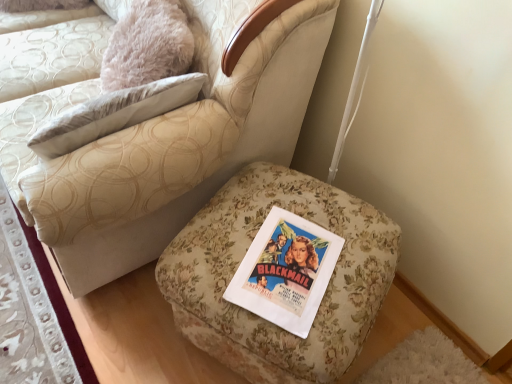
Question: From the image's perspective, is floral fabric ottoman at lower left located above floral fabric ottoman at lower right?

Choices:
 (A) yes
 (B) no

Answer: (B)

Question: Would you say floral fabric ottoman at lower left contains floral fabric ottoman at lower right?

Choices:
 (A) no
 (B) yes

Answer: (A)

Question: Does floral fabric ottoman at lower left have a greater width compared to floral fabric ottoman at lower right?

Choices:
 (A) no
 (B) yes

Answer: (A)

Question: Considering the relative sizes of floral fabric ottoman at lower left and floral fabric ottoman at lower right in the image provided, is floral fabric ottoman at lower left shorter than floral fabric ottoman at lower right?

Choices:
 (A) no
 (B) yes

Answer: (B)

Question: From the image's perspective, is floral fabric ottoman at lower left beneath floral fabric ottoman at lower right?

Choices:
 (A) no
 (B) yes

Answer: (B)

Question: In the image, is floral fabric ottoman at lower right positioned in front of or behind floral fabric ottoman at center?

Choices:
 (A) front
 (B) behind

Answer: (B)

Question: In terms of size, does floral fabric ottoman at lower right appear bigger or smaller than floral fabric ottoman at center?

Choices:
 (A) small
 (B) big

Answer: (A)

Question: Considering the positions of floral fabric ottoman at lower right and floral fabric ottoman at center in the image, is floral fabric ottoman at lower right taller or shorter than floral fabric ottoman at center?

Choices:
 (A) short
 (B) tall

Answer: (A)

Question: From the image's perspective, is floral fabric ottoman at lower right located above or below floral fabric ottoman at center?

Choices:
 (A) above
 (B) below

Answer: (B)

Question: From the image's perspective, is floral fabric ottoman at lower right above or below floral fabric ottoman at lower left?

Choices:
 (A) below
 (B) above

Answer: (B)

Question: Relative to floral fabric ottoman at lower left, is floral fabric ottoman at lower right in front or behind?

Choices:
 (A) front
 (B) behind

Answer: (A)

Question: From their relative heights in the image, would you say floral fabric ottoman at lower right is taller or shorter than floral fabric ottoman at lower left?

Choices:
 (A) short
 (B) tall

Answer: (B)

Question: Would you say floral fabric ottoman at lower right is inside or outside floral fabric ottoman at lower left?

Choices:
 (A) outside
 (B) inside

Answer: (A)

Question: Considering the positions of floral fabric ottoman at lower left and floral fabric ottoman at center in the image, is floral fabric ottoman at lower left bigger or smaller than floral fabric ottoman at center?

Choices:
 (A) big
 (B) small

Answer: (B)

Question: In the image, is floral fabric ottoman at lower left on the left side or the right side of floral fabric ottoman at center?

Choices:
 (A) left
 (B) right

Answer: (A)